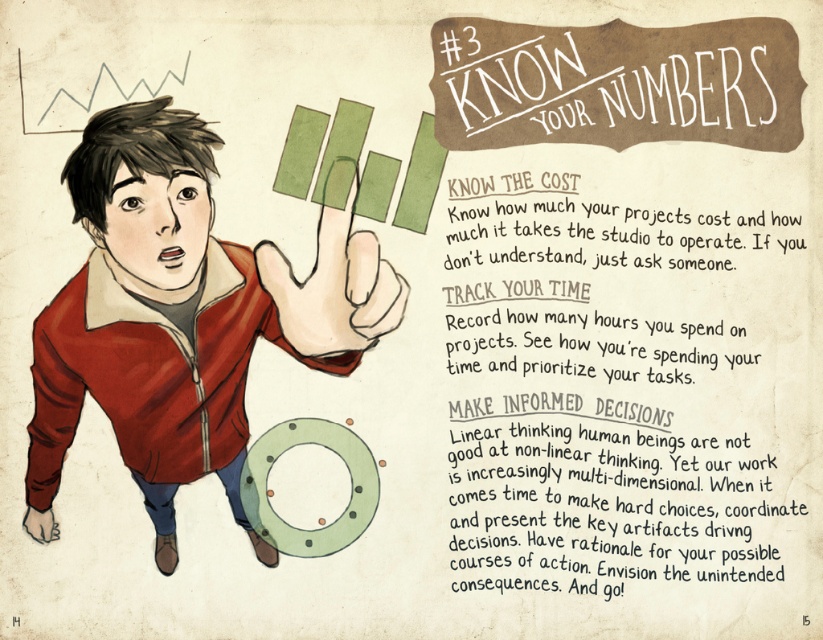
You are a graphic designer who needs to adjust the layout of the image to ensure the brown paper text at upper center and the matte red jacket at center are spaced exactly 12 inches apart. Currently, they are 11.38 inches apart. Which object should you move and in which direction?

→ The brown paper text at upper center is currently 11.38 inches away from the matte red jacket at center. To achieve a 12 inch spacing, move the brown paper text at upper center slightly away from the matte red jacket at center by 0.62 inches.

You are standing in front of the image and notice the matte red jacket at center and the green matte finger at center. Which object appears taller in the image?

The matte red jacket at center is taller than the green matte finger at center according to the description.